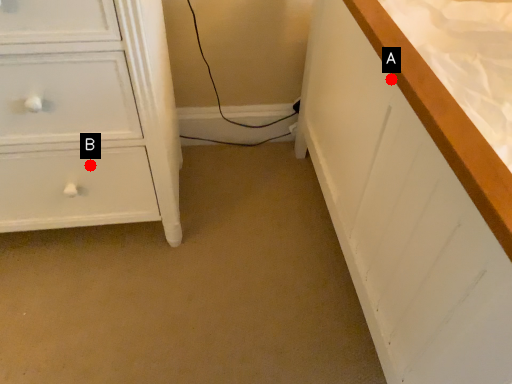
Question: Two points are circled on the image, labeled by A and B beside each circle. Which point is closer to the camera?

Choices:
 (A) A is closer
 (B) B is closer

Answer: (A)